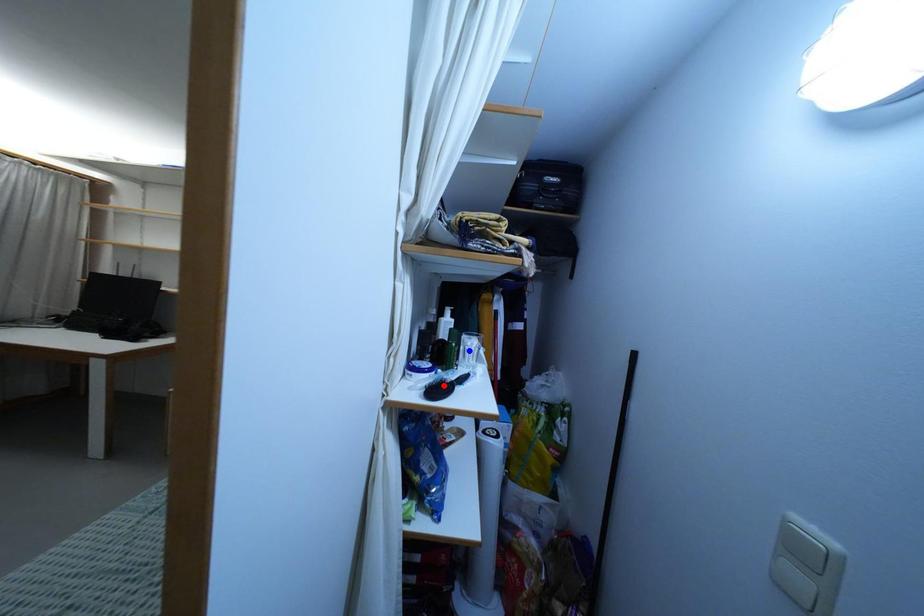
Question: Which of the two points in the image is closer to the camera?

Choices:
 (A) Blue point is closer.
 (B) Red point is closer.

Answer: (B)